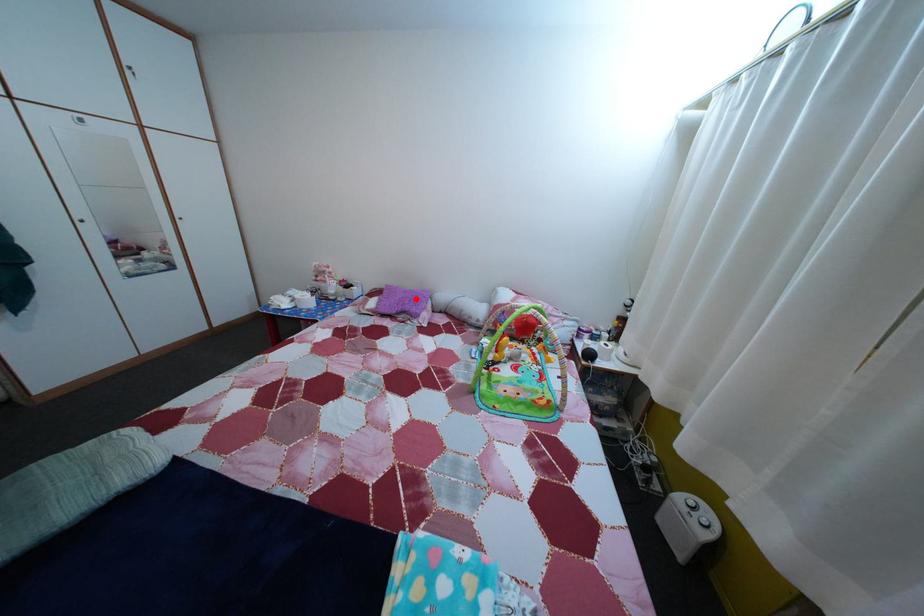
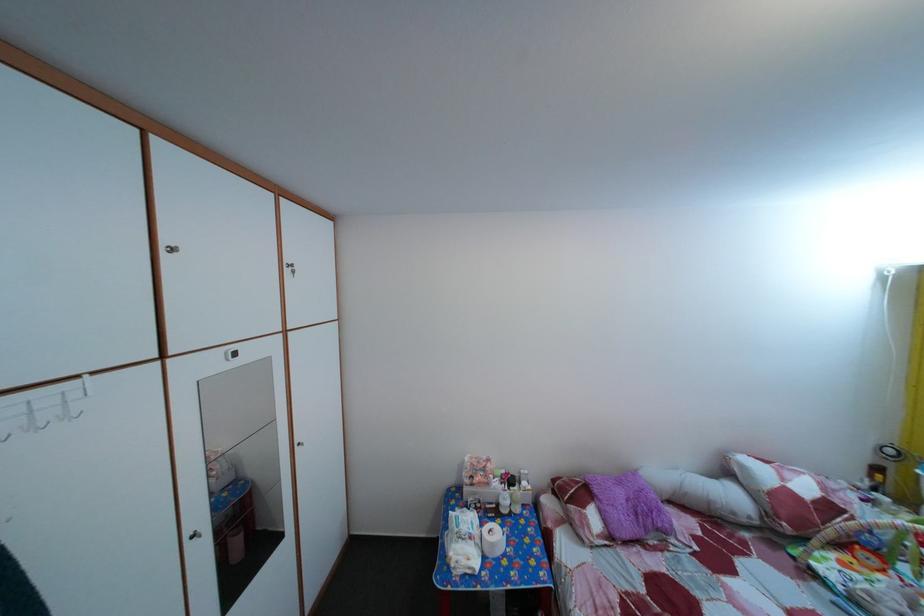
Where in the second image is the point corresponding to the highlighted location from the first image?

(629, 491)